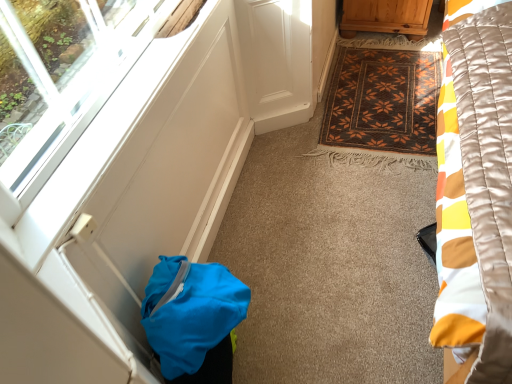
Question: In terms of size, does transparent glass window at lower left appear bigger or smaller than blue fabric bag at lower left?

Choices:
 (A) big
 (B) small

Answer: (B)

Question: Which is correct: transparent glass window at lower left is inside blue fabric bag at lower left, or outside of it?

Choices:
 (A) inside
 (B) outside

Answer: (B)

Question: Which of these objects is positioned farthest from the blue fabric bag at lower left?

Choices:
 (A) wooden cabinet at upper right
 (B) transparent glass window at lower left
 (C) brown woven mat at center

Answer: (A)

Question: Which of these objects is positioned farthest from the wooden cabinet at upper right?

Choices:
 (A) transparent glass window at lower left
 (B) blue fabric bag at lower left
 (C) brown woven mat at center

Answer: (B)